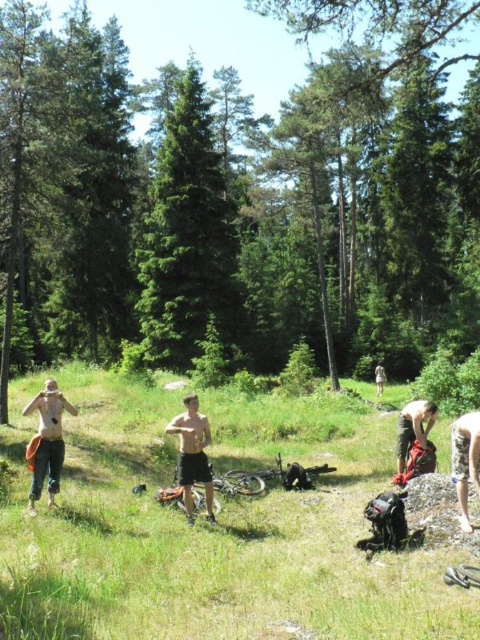
You are a photographer standing in the forest clearing. You want to take a photo that includes both the green leafy tree at center and the skinny jeans at lower right. Which object should you focus on first if you want both to be in sharp focus?

To ensure both the green leafy tree at center and the skinny jeans at lower right are in sharp focus, you should focus on the green leafy tree at center first because it is farther away from the skinny jeans at lower right by 50.13 meters. This distance means the tree requires a greater depth of field to keep both subjects clear.